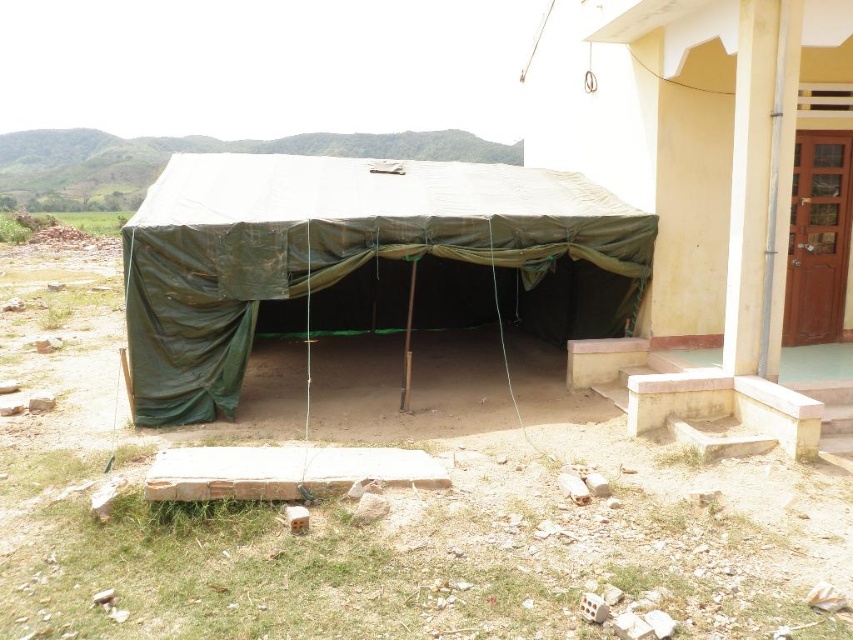
You are standing at the point labeled as point (717,198). Looking around, you see the green tarpaulin tent at lower left. Which direction should you move to reach the building with light yellow walls and brown door?

The green tarpaulin tent at lower left is located at point (717,198). To reach the building with light yellow walls and brown door, you should move to the right of the green tarpaulin tent at lower left since the building is to the right of the tent according to the scene description.

You are standing at the point labeled point (671, 317) and want to walk towards the building with the brown door. Is the point labeled point (468, 324) located in front of or behind you as you face the building?

Point (671, 317) is in front of point (468, 324), so as you face the building, the point (468, 324) would be behind you.

You are standing in front of the building and want to set up a new tent. You have two options to place it either next to the green tarpaulin tent at lower left or near the olive green tarpaulin tent at center. Which location is higher in elevation?

The olive green tarpaulin tent at center is higher in elevation than the green tarpaulin tent at lower left because the green tarpaulin tent at lower left is below it.